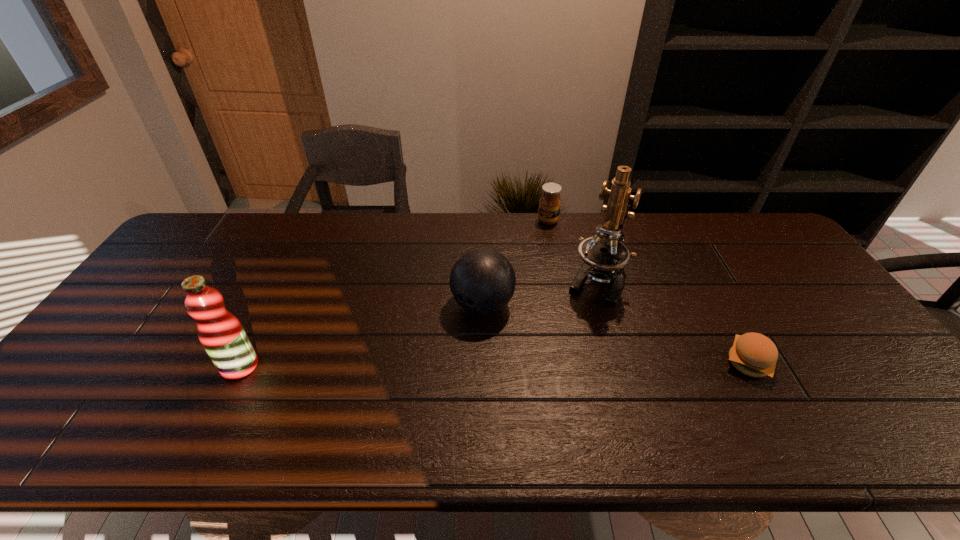
This screenshot has width=960, height=540. I want to click on vacant space situated on the grip area of the bowling ball, so click(429, 366).

You are a GUI agent. You are given a task and a screenshot of the screen. Output one action in this format:
    pyautogui.click(x=<x>, y=<y>)
    Task: Click on the free space located on the grip area of the bowling ball
    
    Given the screenshot: What is the action you would take?
    pyautogui.click(x=445, y=347)

Locate an element on the screen. This screenshot has height=540, width=960. object located in the far edge section of the desktop is located at coordinates (549, 205).

I want to click on fruit juice that is at the near edge, so click(x=223, y=337).

This screenshot has height=540, width=960. I want to click on hamburger at the near edge, so click(753, 354).

Identify the location of free space at the far edge. Image resolution: width=960 pixels, height=540 pixels. (439, 216).

Image resolution: width=960 pixels, height=540 pixels. In order to click on vacant space at the near edge of the desktop in this screenshot , I will do pyautogui.click(x=208, y=405).

Locate an element on the screen. This screenshot has height=540, width=960. free spot at the left edge of the desktop is located at coordinates (127, 374).

Image resolution: width=960 pixels, height=540 pixels. What are the coordinates of `vacant space at the far right corner of the desktop` in the screenshot? It's located at (756, 250).

Locate an element on the screen. The height and width of the screenshot is (540, 960). empty location between the fruit juice and the rightmost object is located at coordinates (494, 364).